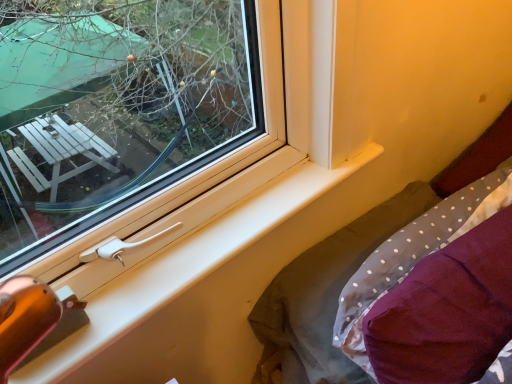
In order to click on free space above white plastic window sill at lower left (from a real-world perspective) in this screenshot , I will do `click(215, 232)`.